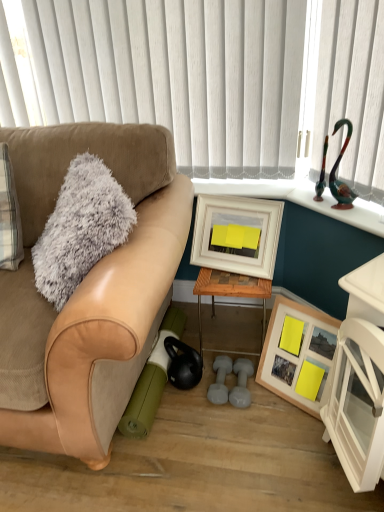
Identify the location of free point in front of wooden framed picture at lower right, which appears as the second picture frame when viewed from the top. (296, 437).